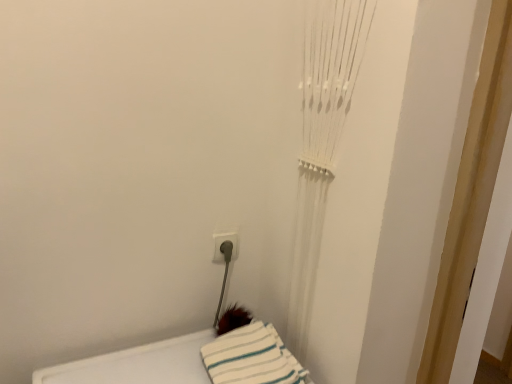
Question: Does white striped fabric at lower center have a lesser width compared to white plastic electric outlet at lower center?

Choices:
 (A) no
 (B) yes

Answer: (A)

Question: Is the depth of white striped fabric at lower center greater than that of white plastic electric outlet at lower center?

Choices:
 (A) no
 (B) yes

Answer: (A)

Question: Would you say white plastic electric outlet at lower center is part of white striped fabric at lower center's contents?

Choices:
 (A) no
 (B) yes

Answer: (A)

Question: Can you confirm if white striped fabric at lower center is wider than white plastic electric outlet at lower center?

Choices:
 (A) yes
 (B) no

Answer: (A)

Question: Can you confirm if white striped fabric at lower center is smaller than white plastic electric outlet at lower center?

Choices:
 (A) no
 (B) yes

Answer: (A)

Question: Is white striped fabric at lower center oriented towards white plastic electric outlet at lower center?

Choices:
 (A) no
 (B) yes

Answer: (A)

Question: Is white plastic electric outlet at lower center with white striped fabric at lower center?

Choices:
 (A) no
 (B) yes

Answer: (A)

Question: From the image's perspective, is white plastic electric outlet at lower center located beneath white striped fabric at lower center?

Choices:
 (A) yes
 (B) no

Answer: (B)

Question: Is white plastic electric outlet at lower center at the right side of white striped fabric at lower center?

Choices:
 (A) no
 (B) yes

Answer: (A)

Question: Does white plastic electric outlet at lower center appear on the left side of white striped fabric at lower center?

Choices:
 (A) no
 (B) yes

Answer: (B)

Question: Considering the relative sizes of white plastic electric outlet at lower center and white striped fabric at lower center in the image provided, is white plastic electric outlet at lower center taller than white striped fabric at lower center?

Choices:
 (A) no
 (B) yes

Answer: (B)

Question: Is white plastic electric outlet at lower center completely or partially outside of white striped fabric at lower center?

Choices:
 (A) no
 (B) yes

Answer: (B)

Question: Considering the positions of point [x=232, y=243] and point [x=271, y=337], is point [x=232, y=243] closer or farther from the camera than point [x=271, y=337]?

Choices:
 (A) closer
 (B) farther

Answer: (B)